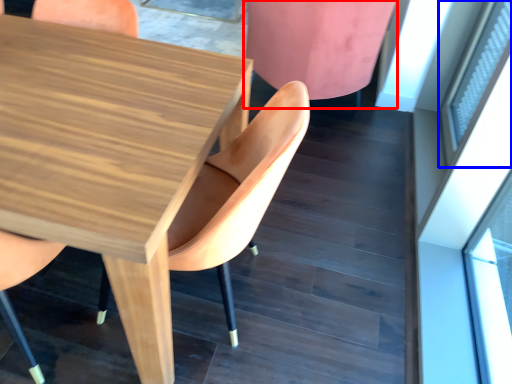
Question: Which object is closer to the camera taking this photo, chair (highlighted by a red box) or window (highlighted by a blue box)?

Choices:
 (A) chair
 (B) window

Answer: (B)